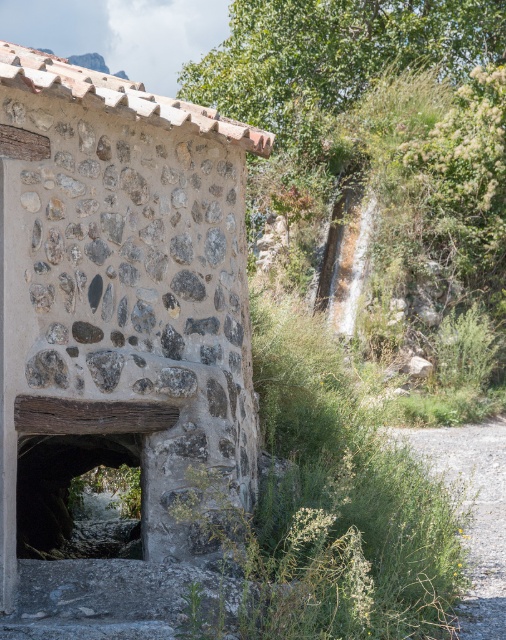
Question: Which point is closer to the camera?

Choices:
 (A) (134, 461)
 (B) (186, 145)

Answer: (B)

Question: Does rustic stone hut at center appear over dark stone tunnel at center?

Choices:
 (A) no
 (B) yes

Answer: (B)

Question: Which of the following is the closest to the observer?

Choices:
 (A) (33, 460)
 (B) (131, 390)

Answer: (B)

Question: In this image, where is rustic stone hut at center located relative to dark stone tunnel at center?

Choices:
 (A) left
 (B) right

Answer: (B)

Question: Among these points, which one is farthest from the camera?

Choices:
 (A) (54, 92)
 (B) (61, 467)

Answer: (B)

Question: Is rustic stone hut at center below dark stone tunnel at center?

Choices:
 (A) no
 (B) yes

Answer: (A)